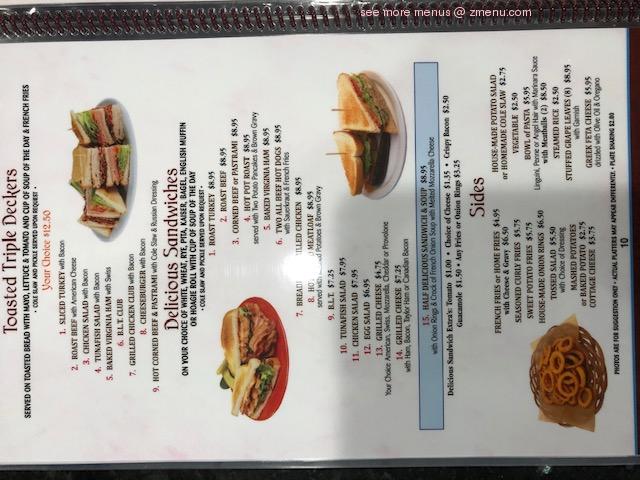
The image size is (640, 480). I want to click on binder spine, so click(611, 164).